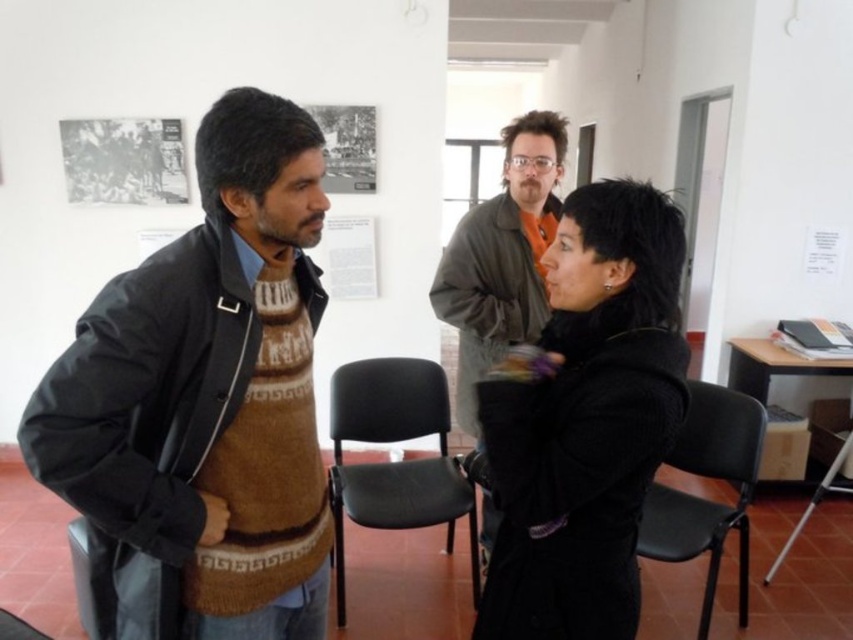
You are an artist who wants to hang a new painting on the wall between the black wool coat at center and the black plastic chair at lower right. Since the coat is taller than the chair, where should you position the painting so it is centered between them?

The black wool coat at center is taller than the black plastic chair at lower right, so to center the painting between them, you should position it closer to the chair since the coat is taller and occupies more vertical space.

You are a photographer standing in the gallery and want to take a closeup shot of the brown knitted sweater at center. Your camera has a minimum focusing distance of 1 meter. Can you take the photo without moving closer than 1 meter?

The distance of brown knitted sweater at center from camera is 1.06 meters, which is just over the camera minimum focusing distance of 1 meter. Therefore, you can take the photo without moving closer than 1 meter.